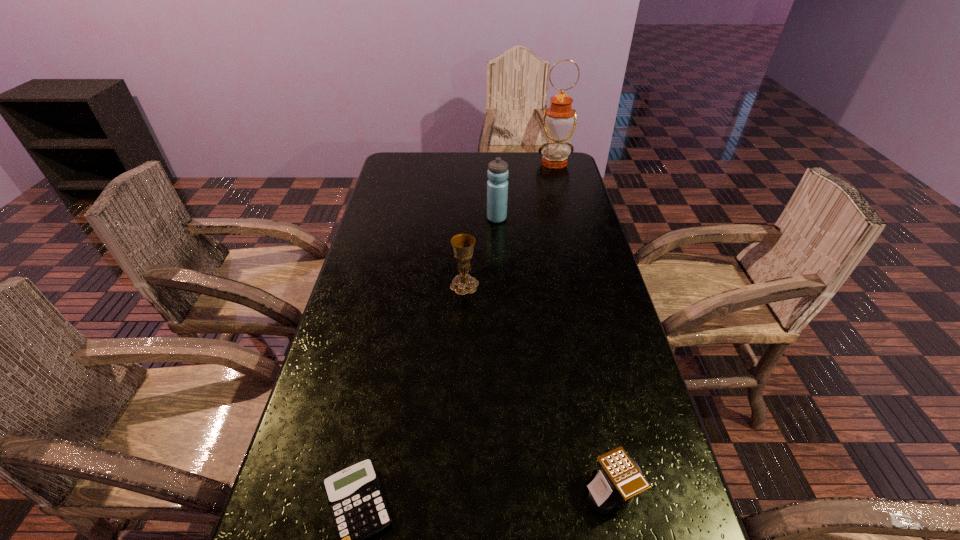
At what (x,y) coordinates should I click in order to perform the action: click on free space located 0.320m on the front of the chalice. Please return your answer as a coordinate pair (x, y). Looking at the image, I should click on (461, 391).

This screenshot has width=960, height=540. I want to click on blank space located on the back of the taller calculator, so click(x=584, y=364).

Locate an element on the screen. This screenshot has height=540, width=960. object at the far edge is located at coordinates (559, 120).

Where is `oil lamp situated at the right edge`? This screenshot has width=960, height=540. oil lamp situated at the right edge is located at coordinates (559, 120).

The width and height of the screenshot is (960, 540). What are the coordinates of `calculator that is at the right edge` in the screenshot? It's located at (620, 478).

Find the location of a particular element. object that is at the far right corner is located at coordinates (559, 120).

The height and width of the screenshot is (540, 960). What are the coordinates of `vacant space at the far edge of the desktop` in the screenshot? It's located at (438, 168).

At what (x,y) coordinates should I click in order to perform the action: click on vacant space at the left edge of the desktop. Please return your answer as a coordinate pair (x, y). Image resolution: width=960 pixels, height=540 pixels. Looking at the image, I should click on (294, 463).

You are a GUI agent. You are given a task and a screenshot of the screen. Output one action in this format:
    pyautogui.click(x=<x>, y=<y>)
    Task: Click on the free space at the right edge of the desktop
    This screenshot has height=540, width=960.
    Given the screenshot: What is the action you would take?
    pyautogui.click(x=611, y=294)

This screenshot has height=540, width=960. In order to click on unoccupied area between the tallest object and the right calculator in this screenshot , I will do `click(583, 327)`.